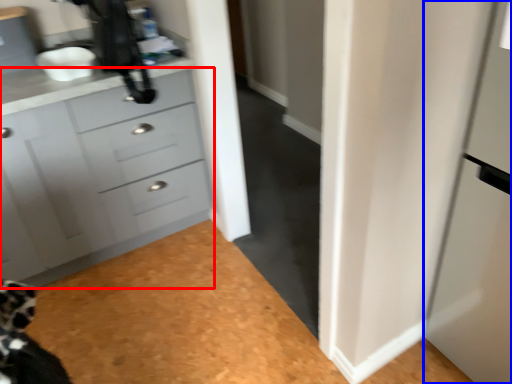
Question: Among these objects, which one is nearest to the camera, chest of drawers (highlighted by a red box) or screen door (highlighted by a blue box)?

Choices:
 (A) chest of drawers
 (B) screen door

Answer: (B)